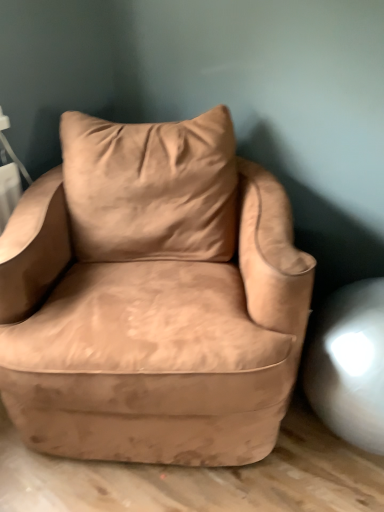
Locate an element on the screen. This screenshot has height=512, width=384. suede-like beige armchair at center is located at coordinates (152, 298).

The height and width of the screenshot is (512, 384). What do you see at coordinates (152, 298) in the screenshot? I see `suede-like beige armchair at center` at bounding box center [152, 298].

The image size is (384, 512). Find the location of `suede-like beige armchair at center`. suede-like beige armchair at center is located at coordinates (152, 298).